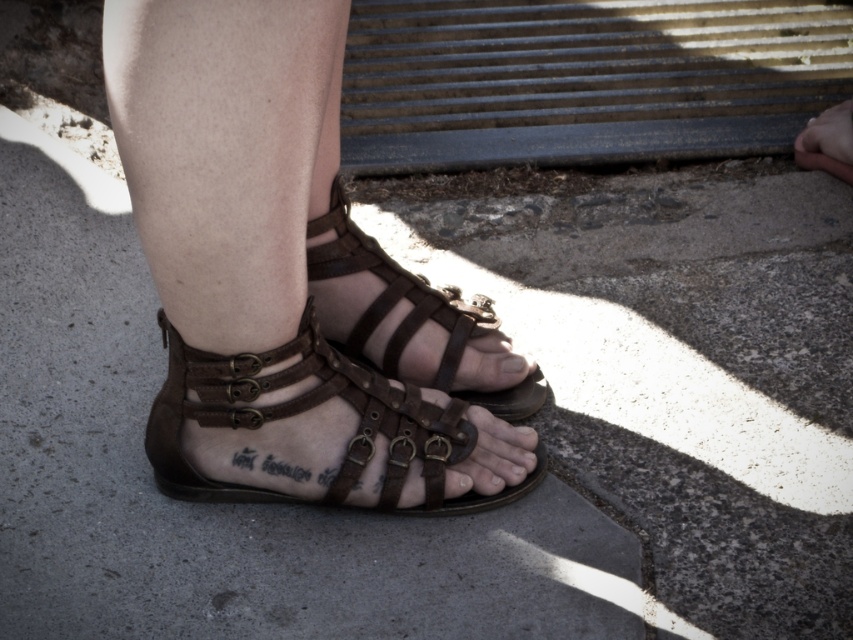
Question: Estimate the real-world distances between objects in this image. Which object is farther from the brown leather toe at center?

Choices:
 (A) brown leather sandals at center
 (B) brown leather sandals at lower center

Answer: (A)

Question: Is brown leather sandal at center bigger than brown leather toe at center?

Choices:
 (A) no
 (B) yes

Answer: (B)

Question: From the image, what is the correct spatial relationship of brown leather sandals at center in relation to brown leather toe at center?

Choices:
 (A) left
 (B) right

Answer: (A)

Question: Which object is closer to the camera taking this photo?

Choices:
 (A) brown leather sandal at center
 (B) brown leather toe at center
 (C) brown leather sandals at center
 (D) brown leather sandals at lower center

Answer: (C)

Question: Can you confirm if brown leather sandal at center is smaller than brown leather toe at center?

Choices:
 (A) yes
 (B) no

Answer: (B)

Question: Which object is positioned closest to the brown leather sandals at lower center?

Choices:
 (A) brown leather toe at center
 (B) brown leather sandals at center

Answer: (B)